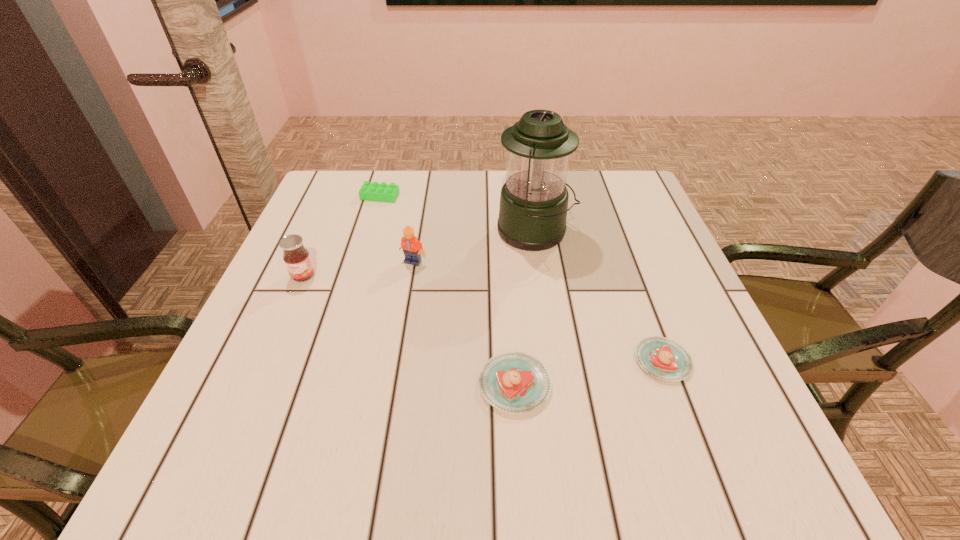
Please show where to add a pastry on the left while keeping spacing even. Please provide its 2D coordinates. Your answer should be formatted as a tuple, i.e. [(x, y)], where the tuple contains the x and y coordinates of a point satisfying the conditions above.

[(352, 410)]